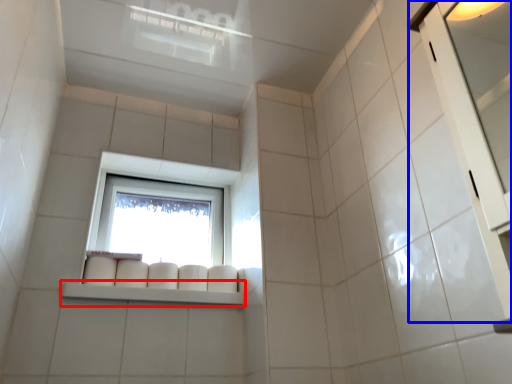
Question: Which object appears farthest to the camera in this image, window sill (highlighted by a red box) or screen door (highlighted by a blue box)?

Choices:
 (A) window sill
 (B) screen door

Answer: (A)